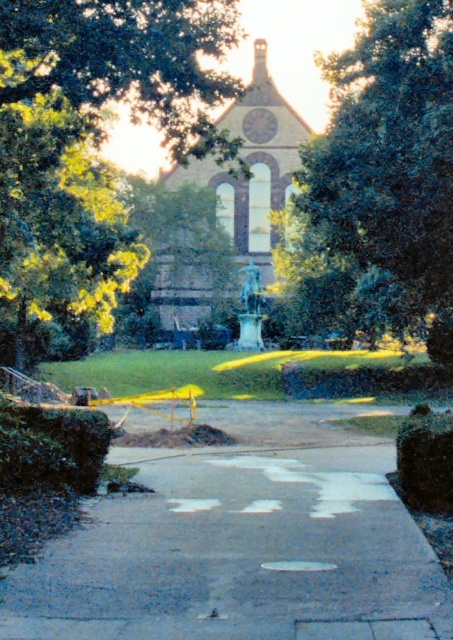
Question: Can you confirm if gray concrete sidewalk at center is thinner than brown stone church at center?

Choices:
 (A) no
 (B) yes

Answer: (B)

Question: Which of the following is the farthest from the observer?

Choices:
 (A) (144, 621)
 (B) (444, 196)
 (C) (13, 276)

Answer: (C)

Question: Does gray concrete sidewalk at center appear on the left side of green leafy tree at center?

Choices:
 (A) no
 (B) yes

Answer: (B)

Question: Among these points, which one is farthest from the camera?

Choices:
 (A) (428, 33)
 (B) (284, 563)
 (C) (206, 312)
 (D) (43, 120)

Answer: (C)

Question: Estimate the real-world distances between objects in this image. Which object is farther from the green leafy tree at center?

Choices:
 (A) green leafy tree at upper center
 (B) brown stone church at center
 (C) gray concrete sidewalk at center

Answer: (C)

Question: Is the position of gray concrete sidewalk at center less distant than that of green leafy tree at center?

Choices:
 (A) no
 (B) yes

Answer: (B)